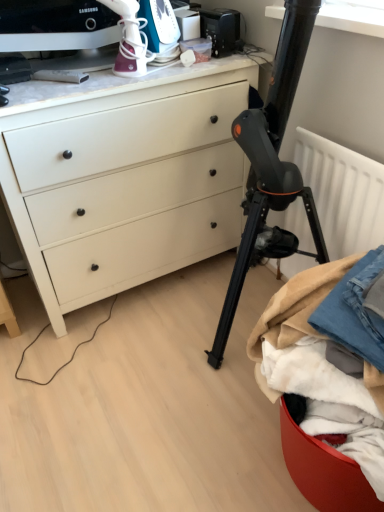
Question: Do you think white plastic iron at upper center, positioned as the second appliance in right-to-left order, is within denim fabric at lower right, acting as the 1th clothing starting from the left, or outside of it?

Choices:
 (A) inside
 (B) outside

Answer: (B)

Question: Is white plastic iron at upper center, which is the 1th appliance from left to right, wider or thinner than denim fabric at lower right, placed as the 2th clothing when sorted from right to left?

Choices:
 (A) wide
 (B) thin

Answer: (B)

Question: Based on their relative distances, which object is farther from the white plastic iron at upper center, which is the 1th appliance from left to right?

Choices:
 (A) denim fabric at lower right, acting as the 1th clothing starting from the left
 (B) black plastic toaster at upper center, which ranks as the 2th appliance in left-to-right order
 (C) denim fabric at lower right, acting as the first clothing starting from the right
 (D) white textured radiator at right
 (E) matte white chest of drawers at upper left

Answer: (A)

Question: Which is nearer to the white textured radiator at right?

Choices:
 (A) matte white chest of drawers at upper left
 (B) denim fabric at lower right, arranged as the 2th clothing when viewed from the left
 (C) white plastic iron at upper center, positioned as the second appliance in right-to-left order
 (D) black plastic toaster at upper center, the first appliance in the right-to-left sequence
 (E) denim fabric at lower right, acting as the 1th clothing starting from the left

Answer: (B)